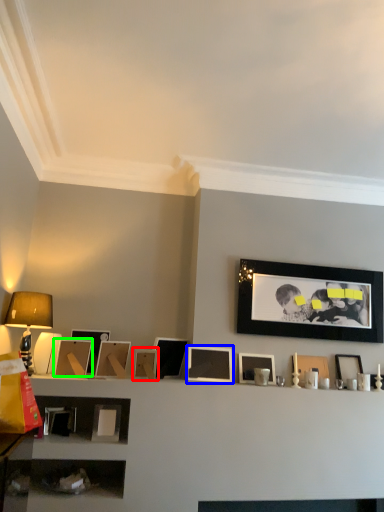
Question: Which object is the farthest from picture frame (highlighted by a red box)? Choose among these: picture frame (highlighted by a blue box) or picture frame (highlighted by a green box).

Choices:
 (A) picture frame
 (B) picture frame

Answer: (B)